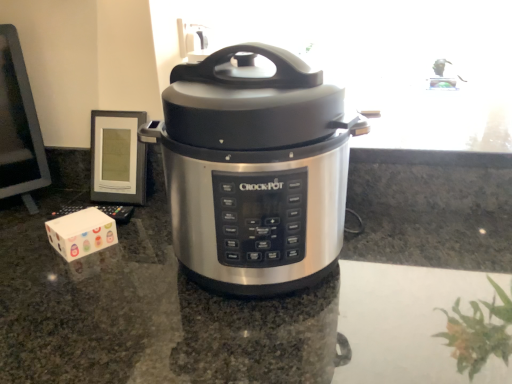
What do you see at coordinates (81, 233) in the screenshot? I see `white cardboard box at lower left` at bounding box center [81, 233].

What is the approximate height of white cardboard box at lower left?

5.13 centimeters.

What do you see at coordinates (141, 304) in the screenshot? I see `stainless steel countertop at center` at bounding box center [141, 304].

I want to click on white cardboard box at lower left, so click(x=81, y=233).

What are the coordinates of `counter top on the right of the stainless steel slow cooker at center` in the screenshot? It's located at (141, 304).

Is stainless steel countertop at center outside of stainless steel slow cooker at center?

stainless steel countertop at center lies outside stainless steel slow cooker at center's area.

Is stainless steel countertop at center oriented towards stainless steel slow cooker at center?

No, stainless steel countertop at center is not turned towards stainless steel slow cooker at center.

How many degrees apart are the facing directions of stainless steel countertop at center and stainless steel slow cooker at center?

2.58 degrees.

Looking at this image, is stainless steel countertop at center positioned with its back to white cardboard box at lower left?

No, stainless steel countertop at center is not facing away from white cardboard box at lower left.

Between stainless steel countertop at center and white cardboard box at lower left, which one has larger width?

stainless steel countertop at center.

Considering the sizes of objects stainless steel countertop at center and white cardboard box at lower left in the image provided, who is bigger, stainless steel countertop at center or white cardboard box at lower left?

stainless steel countertop at center.

Is stainless steel countertop at center in front of or behind white cardboard box at lower left in the image?

Clearly, stainless steel countertop at center is in front of white cardboard box at lower left.

Is white cardboard box at lower left wider than stainless steel slow cooker at center?

In fact, white cardboard box at lower left might be narrower than stainless steel slow cooker at center.

Looking at this image, does white cardboard box at lower left have a larger size compared to stainless steel slow cooker at center?

Incorrect, white cardboard box at lower left is not larger than stainless steel slow cooker at center.

In the scene shown: Is white cardboard box at lower left directly adjacent to stainless steel slow cooker at center?

No, white cardboard box at lower left is not touching stainless steel slow cooker at center.

From a real-world perspective, does white cardboard box at lower left sit lower than stainless steel slow cooker at center?

Correct, in the physical world, white cardboard box at lower left is lower than stainless steel slow cooker at center.

Does point (68, 242) come in front of point (138, 218)?

Yes.

Is white cardboard box at lower left not inside stainless steel countertop at center?

Actually, white cardboard box at lower left is within stainless steel countertop at center.

From the picture: Does white cardboard box at lower left appear on the right side of stainless steel countertop at center?

No, white cardboard box at lower left is not to the right of stainless steel countertop at center.

Is white cardboard box at lower left not near stainless steel countertop at center?

No, white cardboard box at lower left is in close proximity to stainless steel countertop at center.

Considering the relative sizes of stainless steel slow cooker at center and white cardboard box at lower left in the image provided, is stainless steel slow cooker at center smaller than white cardboard box at lower left?

Incorrect, stainless steel slow cooker at center is not smaller in size than white cardboard box at lower left.

Considering the positions of objects stainless steel slow cooker at center and white cardboard box at lower left in the image provided, who is behind, stainless steel slow cooker at center or white cardboard box at lower left?

Positioned behind is white cardboard box at lower left.

Measure the distance from stainless steel slow cooker at center to white cardboard box at lower left.

stainless steel slow cooker at center is 13.73 inches away from white cardboard box at lower left.

From the image's perspective, which is below, stainless steel slow cooker at center or white cardboard box at lower left?

From the image's view, white cardboard box at lower left is below.

Between stainless steel slow cooker at center and stainless steel countertop at center, which one has larger width?

stainless steel countertop at center is wider.

Which point is more forward, (179,182) or (249,301)?

Point (179,182)

You are a GUI agent. You are given a task and a screenshot of the screen. Output one action in this format:
    pyautogui.click(x=<x>, y=<y>)
    Task: Click on the slow cooker that is on the left side of stainless steel countertop at center
    The width and height of the screenshot is (512, 384).
    Given the screenshot: What is the action you would take?
    pyautogui.click(x=254, y=170)

Locate an element on the screen. Image resolution: width=512 pixels, height=384 pixels. counter top located below the stainless steel slow cooker at center (from the image's perspective) is located at coordinates (141, 304).

In order to click on block located behind the stainless steel countertop at center in this screenshot , I will do `click(81, 233)`.

Based on their spatial positions, is stainless steel countertop at center or white cardboard box at lower left further from stainless steel slow cooker at center?

white cardboard box at lower left is positioned further to the anchor stainless steel slow cooker at center.

Estimate the real-world distances between objects in this image. Which object is closer to white cardboard box at lower left, stainless steel countertop at center or stainless steel slow cooker at center?

stainless steel countertop at center is closer to white cardboard box at lower left.

From the image, which object appears to be nearer to stainless steel countertop at center, stainless steel slow cooker at center or white cardboard box at lower left?

stainless steel slow cooker at center.

Based on their spatial positions, is white cardboard box at lower left or stainless steel countertop at center further from stainless steel slow cooker at center?

The object further to stainless steel slow cooker at center is white cardboard box at lower left.

Which object lies further to the anchor point stainless steel countertop at center, white cardboard box at lower left or stainless steel slow cooker at center?

Based on the image, white cardboard box at lower left appears to be further to stainless steel countertop at center.

When comparing their distances from white cardboard box at lower left, does stainless steel slow cooker at center or stainless steel countertop at center seem further?

The object further to white cardboard box at lower left is stainless steel slow cooker at center.

Find the location of a particular element. This screenshot has width=512, height=384. block between stainless steel slow cooker at center and stainless steel countertop at center vertically is located at coordinates click(x=81, y=233).